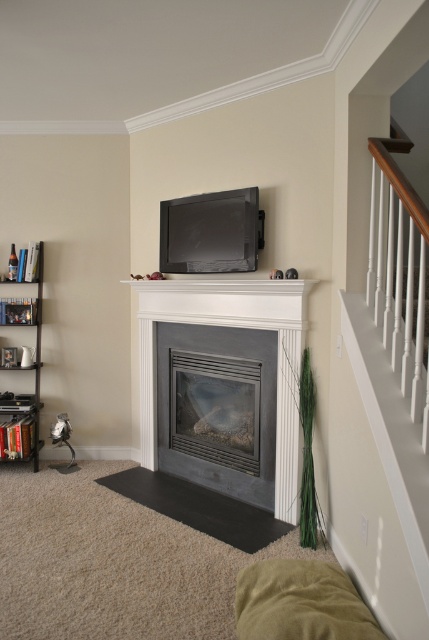
Question: Is matte black fireplace at center wider than matte black tv at upper center?

Choices:
 (A) yes
 (B) no

Answer: (A)

Question: Estimate the real-world distances between objects in this image. Which object is closer to the matte black tv at upper center?

Choices:
 (A) matte black fireplace at center
 (B) metallic silver bookshelf at left

Answer: (A)

Question: Which object is the closest to the matte black fireplace at center?

Choices:
 (A) matte black tv at upper center
 (B) metallic silver bookshelf at left
 (C) white glossy fireplace at center

Answer: (C)

Question: Does white glossy fireplace at center appear on the left side of matte black tv at upper center?

Choices:
 (A) yes
 (B) no

Answer: (B)

Question: Considering the relative positions of white glossy fireplace at center and matte black tv at upper center in the image provided, where is white glossy fireplace at center located with respect to matte black tv at upper center?

Choices:
 (A) below
 (B) above

Answer: (A)

Question: Estimate the real-world distances between objects in this image. Which object is closer to the white glossy fireplace at center?

Choices:
 (A) matte black tv at upper center
 (B) matte black fireplace at center
 (C) metallic silver bookshelf at left

Answer: (B)